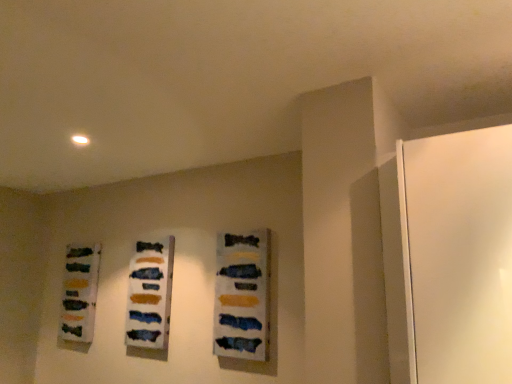
Question: From the image's perspective, would you say matte acrylic painting at center, which ranks as the second art in left-to-right order, is shown under matte acrylic painting at center, the third art when ordered from back to front?

Choices:
 (A) no
 (B) yes

Answer: (B)

Question: Can we say matte acrylic painting at center, the 2th art from the right, lies outside matte acrylic painting at center, which is the first art from front to back?

Choices:
 (A) no
 (B) yes

Answer: (B)

Question: Is matte acrylic painting at center, the 2th art from the right, positioned before matte acrylic painting at center, the first art positioned from the right?

Choices:
 (A) yes
 (B) no

Answer: (B)

Question: Are matte acrylic painting at center, which ranks as the second art in front-to-back order, and matte acrylic painting at center, the third art when ordered from left to right, far apart?

Choices:
 (A) no
 (B) yes

Answer: (A)

Question: Does matte acrylic painting at center, which ranks as the second art in left-to-right order, come behind matte acrylic painting at center, the first art positioned from the right?

Choices:
 (A) no
 (B) yes

Answer: (B)

Question: Does point (145, 284) appear closer or farther from the camera than point (260, 254)?

Choices:
 (A) closer
 (B) farther

Answer: (B)

Question: From a real-world perspective, relative to matte acrylic painting at center, the third art when ordered from back to front, is matte acrylic painting at center, which ranks as the second art in front-to-back order, vertically above or below?

Choices:
 (A) above
 (B) below

Answer: (B)

Question: Based on their positions, is matte acrylic painting at center, which ranks as the second art in left-to-right order, located to the left or right of matte acrylic painting at center, the third art when ordered from left to right?

Choices:
 (A) right
 (B) left

Answer: (B)

Question: From the image's perspective, is matte acrylic painting at center, which appears as the second art when viewed from the back, located above or below matte acrylic painting at center, the third art when ordered from left to right?

Choices:
 (A) below
 (B) above

Answer: (A)

Question: Is point (139, 291) positioned closer to the camera than point (81, 254)?

Choices:
 (A) closer
 (B) farther

Answer: (A)

Question: Choose the correct answer: Is matte acrylic painting at center, the 2th art from the right, inside matte glass bottles at left, arranged as the 3th art when viewed from the front, or outside it?

Choices:
 (A) inside
 (B) outside

Answer: (B)

Question: In terms of width, does matte acrylic painting at center, the 2th art from the right, look wider or thinner when compared to matte glass bottles at left, arranged as the 3th art when viewed from the front?

Choices:
 (A) wide
 (B) thin

Answer: (B)

Question: Considering the positions of matte acrylic painting at center, the 2th art from the right, and matte glass bottles at left, arranged as the 3th art when viewed from the front, in the image, is matte acrylic painting at center, the 2th art from the right, bigger or smaller than matte glass bottles at left, arranged as the 3th art when viewed from the front,?

Choices:
 (A) big
 (B) small

Answer: (B)

Question: In terms of width, does matte glass bottles at left, arranged as the 3th art when viewed from the right, look wider or thinner when compared to matte acrylic painting at center, the 2th art from the right?

Choices:
 (A) wide
 (B) thin

Answer: (A)

Question: Is point (72, 248) positioned closer to the camera than point (166, 296)?

Choices:
 (A) closer
 (B) farther

Answer: (B)